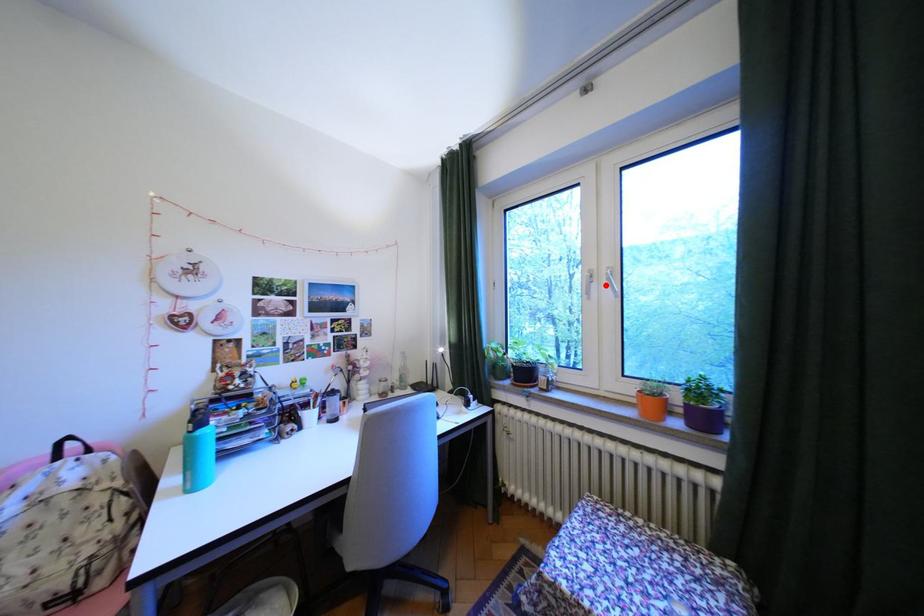
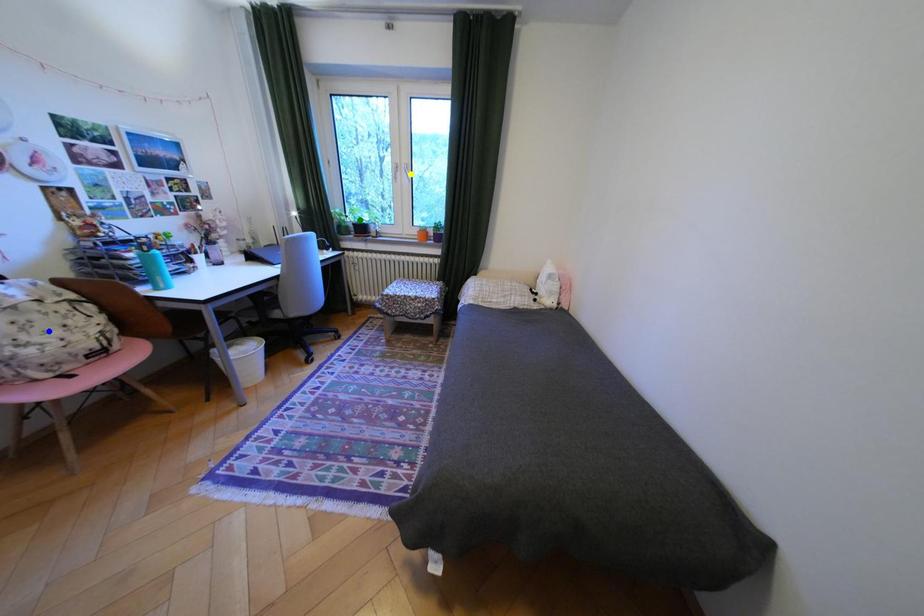
Question: I am providing you with two images of the same scene from different viewpoints. A red point is marked on the first image. You are given multiple points on the second image. Which point in image 2 represents the same 3d spot as the red point in image 1?

Choices:
 (A) green point
 (B) yellow point
 (C) blue point

Answer: (B)